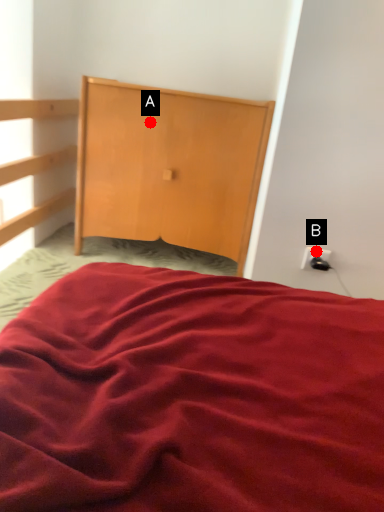
Question: Two points are circled on the image, labeled by A and B beside each circle. Which point appears farthest from the camera in this image?

Choices:
 (A) A is further
 (B) B is further

Answer: (A)